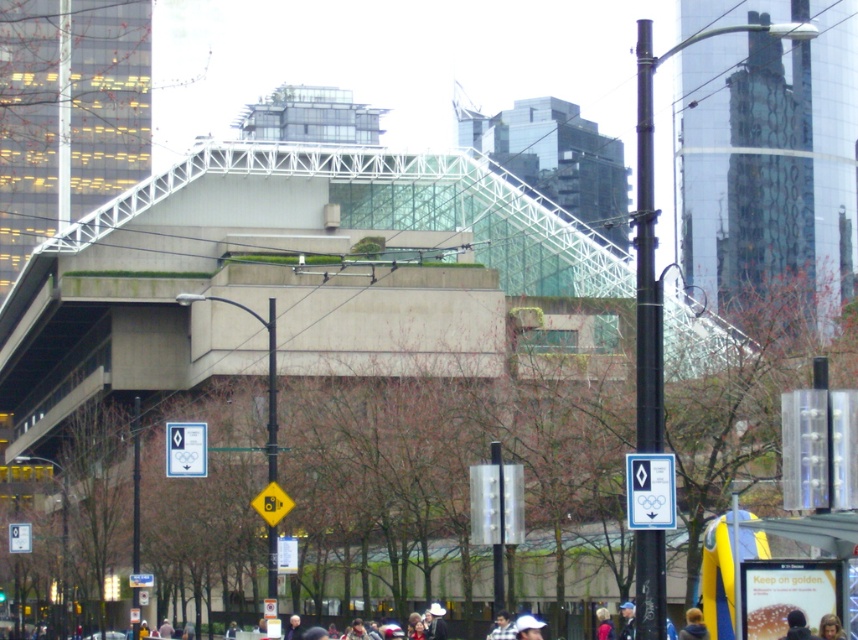
Between white plastic sign at center and blonde hair at center, which one is positioned higher?

Positioned higher is white plastic sign at center.

Which of these two, white plastic sign at center or blonde hair at center, stands shorter?

With less height is blonde hair at center.

At what (x,y) coordinates should I click in order to perform the action: click on white plastic sign at center. Please return your answer as a coordinate pair (x, y). This screenshot has width=858, height=640. Looking at the image, I should click on (185, 449).

Locate an element on the screen. The image size is (858, 640). white plastic sign at center is located at coordinates (185, 449).

Between white plastic sign at center and smooth skin face at lower right, which one has more height?

Standing taller between the two is white plastic sign at center.

Is point (173, 435) positioned before point (783, 637)?

No.

You are a GUI agent. You are given a task and a screenshot of the screen. Output one action in this format:
    pyautogui.click(x=<x>, y=<y>)
    Task: Click on the white plastic sign at center
    
    Given the screenshot: What is the action you would take?
    pyautogui.click(x=185, y=449)

Is white plastic sign at center to the left of dark blue shirt at lower center from the viewer's perspective?

Indeed, white plastic sign at center is positioned on the left side of dark blue shirt at lower center.

This screenshot has width=858, height=640. What do you see at coordinates (185, 449) in the screenshot?
I see `white plastic sign at center` at bounding box center [185, 449].

Locate an element on the screen. This screenshot has height=640, width=858. white plastic sign at center is located at coordinates (185, 449).